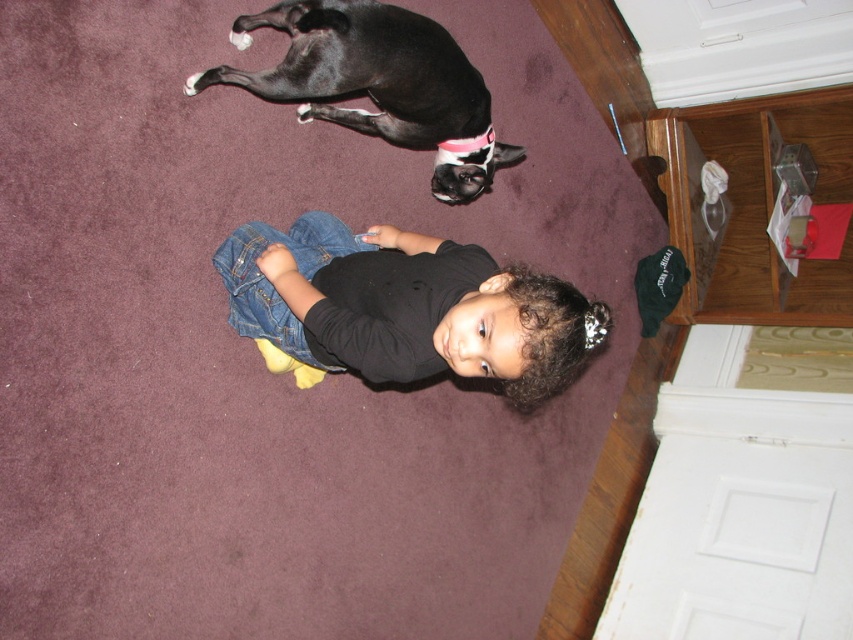
You are a toy robot that needs to pick up the denim jeans at center and the black matte dog at upper center. Based on their heights, which one do you need to adjust your height to reach first?

The denim jeans at center is taller than the black matte dog at upper center, so you should adjust your height to reach the denim jeans at center first before adjusting for the shorter black matte dog at upper center.

You are a delivery robot that needs to place a package between the denim jeans at center and the black matte dog at upper center. The package is 10 inches long. Can the package fit between them without overlapping either object?

The denim jeans at center and black matte dog at upper center are 17.88 inches apart from each other. Since the package is 10 inches long, it can fit between them without overlapping either object as there is enough space.